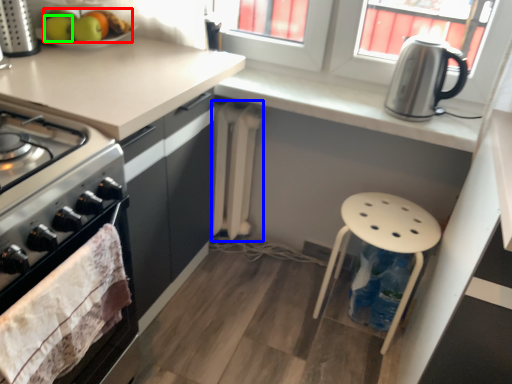
Question: Which is nearer to the fruit (highlighted by a red box)? radiator (highlighted by a blue box) or apple (highlighted by a green box).

Choices:
 (A) radiator
 (B) apple

Answer: (B)